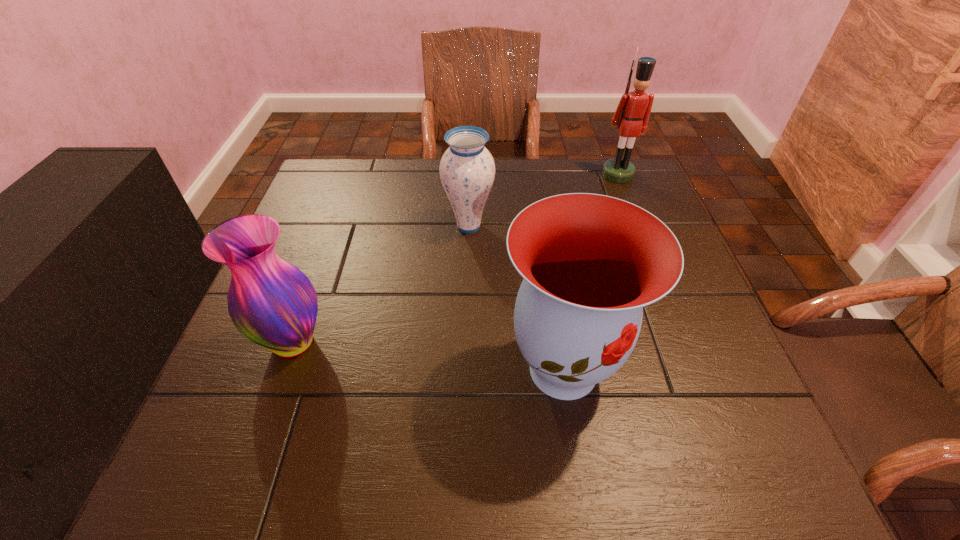
Where is `vacant space at the far right corner`? vacant space at the far right corner is located at coordinates (636, 160).

The image size is (960, 540). In order to click on free location at the near right corner of the desktop in this screenshot , I will do `click(756, 440)`.

I want to click on free space between the second vase from right to left and the leftmost object, so click(381, 284).

What are the coordinates of `free space between the rightmost vase and the leftmost object` in the screenshot? It's located at (428, 356).

Image resolution: width=960 pixels, height=540 pixels. Identify the location of empty space between the rightmost object and the leftmost object. (456, 258).

This screenshot has height=540, width=960. In order to click on free spot between the third nearest object and the leftmost vase in this screenshot , I will do `click(381, 284)`.

What are the coordinates of `unoccupied position between the second vase from left to right and the third object from left to right` in the screenshot? It's located at (516, 298).

Where is `free space between the rightmost vase and the second farthest object`? free space between the rightmost vase and the second farthest object is located at coordinates (516, 298).

This screenshot has width=960, height=540. Find the location of `vacant space that is in between the second vase from left to right and the leftmost object`. vacant space that is in between the second vase from left to right and the leftmost object is located at coordinates (381, 284).

This screenshot has width=960, height=540. Find the location of `free space that is in between the leftmost vase and the farthest object`. free space that is in between the leftmost vase and the farthest object is located at coordinates (456, 258).